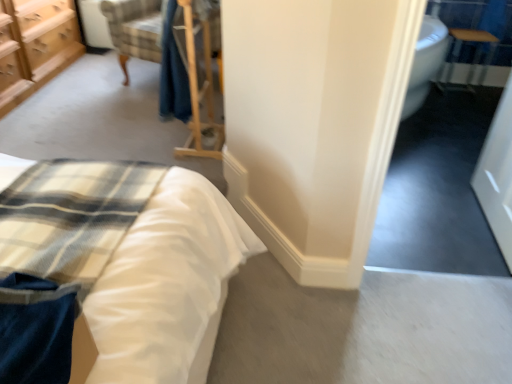
This screenshot has width=512, height=384. Find the location of `vacant space underneath wooden table at upper right (from a real-world perspective)`. vacant space underneath wooden table at upper right (from a real-world perspective) is located at coordinates (453, 93).